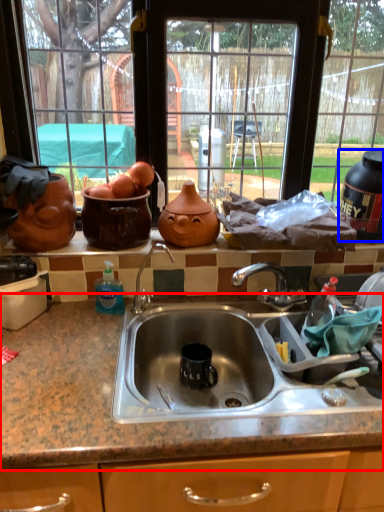
Question: Which object appears farthest to the camera in this image, countertop (highlighted by a red box) or appliance (highlighted by a blue box)?

Choices:
 (A) countertop
 (B) appliance

Answer: (B)